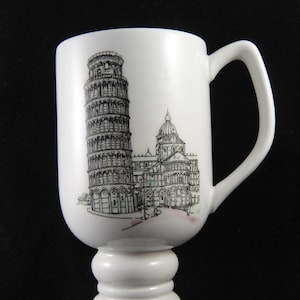
Locate an element on the screen. The width and height of the screenshot is (300, 300). white pottery is located at coordinates (175, 91), (153, 271).